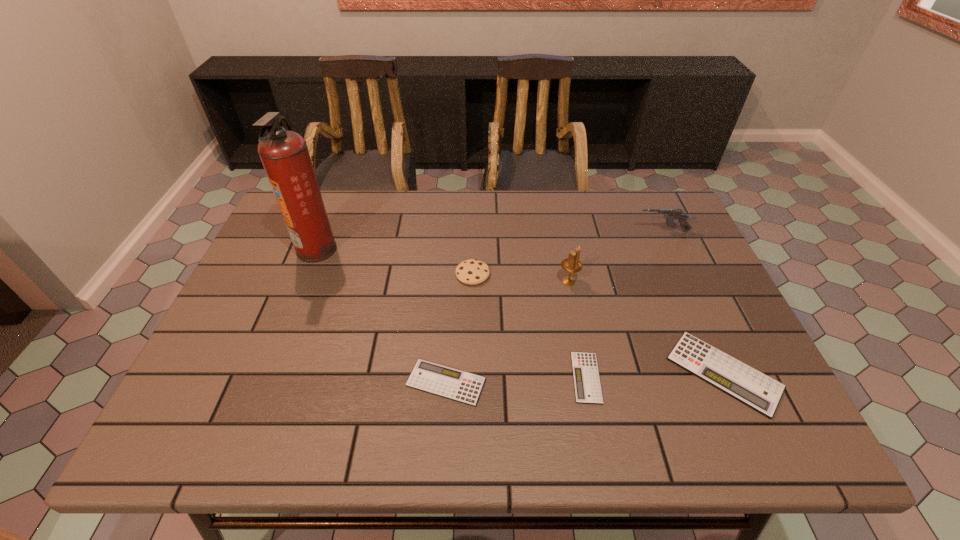
The image size is (960, 540). Find the location of `vacant space that satisfies the following two spatial constraints: 1. at the nozzle of the shortest calculator; 2. on the right side of the fire extinguisher`. vacant space that satisfies the following two spatial constraints: 1. at the nozzle of the shortest calculator; 2. on the right side of the fire extinguisher is located at coordinates (266, 377).

Find the location of `free space in the image that satisfies the following two spatial constraints: 1. at the barrel of the gun; 2. on the front side of the shortest object`. free space in the image that satisfies the following two spatial constraints: 1. at the barrel of the gun; 2. on the front side of the shortest object is located at coordinates (730, 377).

This screenshot has width=960, height=540. What are the coordinates of `vacant space that satisfies the following two spatial constraints: 1. at the barrel of the fifth shortest object; 2. on the front side of the second shortest object` in the screenshot? It's located at (732, 382).

Image resolution: width=960 pixels, height=540 pixels. Find the location of `vacant space that satisfies the following two spatial constraints: 1. on the front side of the fourth tallest object; 2. on the right side of the shortest calculator`. vacant space that satisfies the following two spatial constraints: 1. on the front side of the fourth tallest object; 2. on the right side of the shortest calculator is located at coordinates (470, 377).

Identify the location of vacant space that satisfies the following two spatial constraints: 1. on the front side of the cookie; 2. on the right side of the rightmost calculator. (471, 373).

In order to click on blank space that satisfies the following two spatial constraints: 1. on the front side of the cookie; 2. on the left side of the shortest object in this screenshot , I will do `click(470, 377)`.